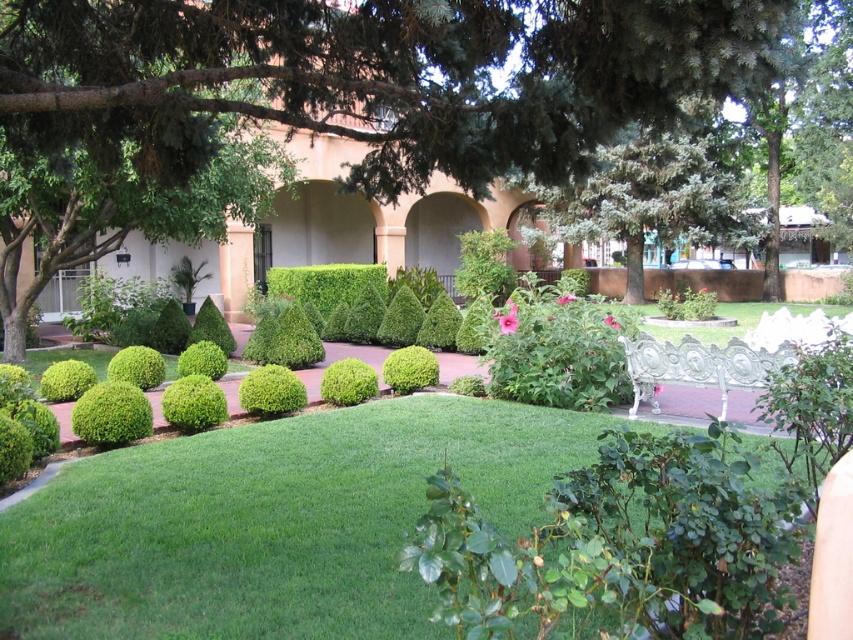
Who is shorter, green smooth grass at center or green matte shrub at center?

With less height is green smooth grass at center.

Is green smooth grass at center bigger than green matte shrub at center?

Incorrect, green smooth grass at center is not larger than green matte shrub at center.

Locate an element on the screen. The width and height of the screenshot is (853, 640). green smooth grass at center is located at coordinates (274, 522).

The width and height of the screenshot is (853, 640). I want to click on green smooth grass at center, so click(x=274, y=522).

Is green leafy tree at center shorter than green smooth grass at center?

No.

Between point (341, 51) and point (105, 538), which one is positioned behind?

The point (105, 538) is more distant.

Where is `green leafy tree at center`? Image resolution: width=853 pixels, height=640 pixels. green leafy tree at center is located at coordinates (373, 77).

Who is higher up, green leafy tree at center or green matte shrub at center?

green leafy tree at center

Between point (393, 61) and point (97, 426), which one is positioned behind?

Positioned behind is point (97, 426).

Identify the location of green leafy tree at center. The height and width of the screenshot is (640, 853). (373, 77).